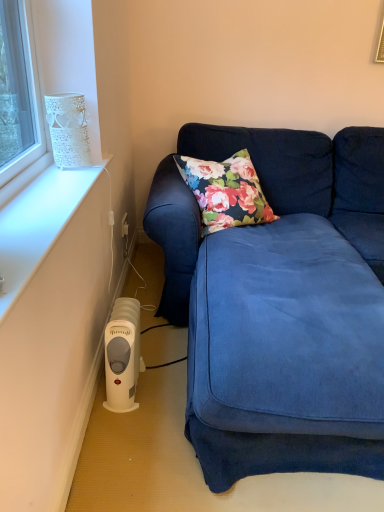
Question: Is white plastic heater at lower left looking in the opposite direction of white textured vase at upper left?

Choices:
 (A) no
 (B) yes

Answer: (A)

Question: Is white plastic heater at lower left far from white textured vase at upper left?

Choices:
 (A) yes
 (B) no

Answer: (B)

Question: Is white plastic heater at lower left positioned before white textured vase at upper left?

Choices:
 (A) yes
 (B) no

Answer: (A)

Question: From a real-world perspective, is white plastic heater at lower left beneath white textured vase at upper left?

Choices:
 (A) yes
 (B) no

Answer: (A)

Question: Considering the relative positions of white plastic heater at lower left and white textured vase at upper left in the image provided, is white plastic heater at lower left to the right of white textured vase at upper left from the viewer's perspective?

Choices:
 (A) no
 (B) yes

Answer: (B)

Question: Considering the relative sizes of white plastic heater at lower left and white textured vase at upper left in the image provided, is white plastic heater at lower left smaller than white textured vase at upper left?

Choices:
 (A) yes
 (B) no

Answer: (B)

Question: Is white plastic heater at lower left positioned beyond the bounds of velvet blue couch at lower right?

Choices:
 (A) no
 (B) yes

Answer: (A)

Question: From the image's perspective, is white plastic heater at lower left beneath velvet blue couch at lower right?

Choices:
 (A) yes
 (B) no

Answer: (A)

Question: From a real-world perspective, is white plastic heater at lower left physically below velvet blue couch at lower right?

Choices:
 (A) yes
 (B) no

Answer: (A)

Question: Is white plastic heater at lower left aimed at velvet blue couch at lower right?

Choices:
 (A) no
 (B) yes

Answer: (B)

Question: Does white plastic heater at lower left come in front of velvet blue couch at lower right?

Choices:
 (A) no
 (B) yes

Answer: (A)

Question: Is white plastic heater at lower left shorter than velvet blue couch at lower right?

Choices:
 (A) no
 (B) yes

Answer: (B)

Question: Does velvet blue couch at lower right have a smaller size compared to white plastic heater at lower left?

Choices:
 (A) no
 (B) yes

Answer: (A)